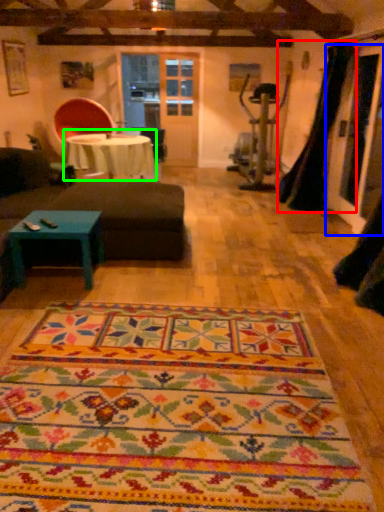
Question: Which object is the closest to the curtain (highlighted by a red box)? Choose among these: glass door (highlighted by a blue box) or table (highlighted by a green box).

Choices:
 (A) glass door
 (B) table

Answer: (A)